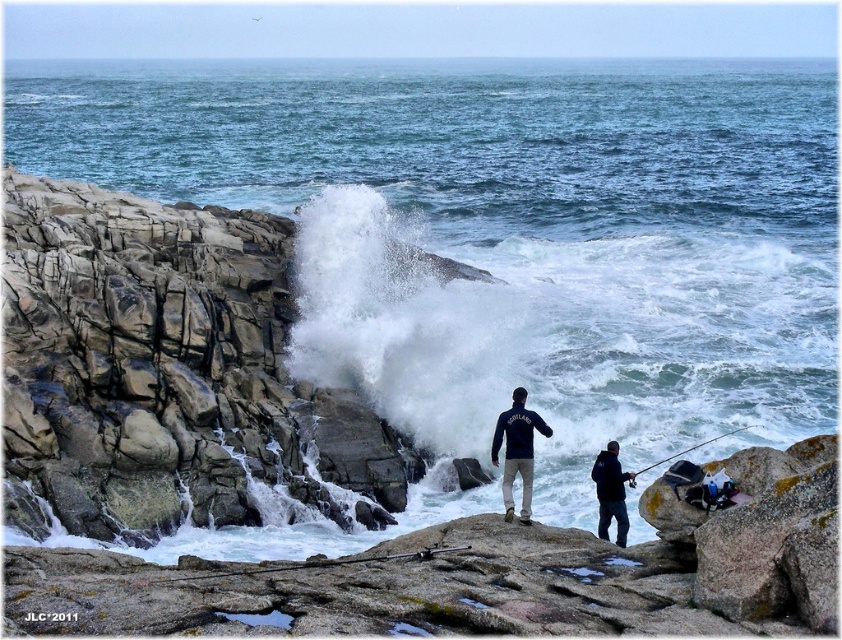
Question: Which point appears farthest from the camera in this image?

Choices:
 (A) (505, 426)
 (B) (430, 556)
 (C) (601, 458)
 (D) (718, 435)

Answer: (D)

Question: Which of the following is the farthest from the observer?

Choices:
 (A) dark blue fleece jacket at center
 (B) black matte fishing pole at lower right
 (C) dark blue jacket at lower right

Answer: (B)

Question: Which point is farther to the camera?

Choices:
 (A) dark blue fleece jacket at center
 (B) metallic silver fishing pole at center
 (C) dark blue jacket at lower right

Answer: (C)

Question: Can you confirm if metallic silver fishing pole at center is positioned below black matte fishing pole at lower right?

Choices:
 (A) yes
 (B) no

Answer: (A)

Question: Does dark blue jacket at lower right appear on the left side of metallic silver fishing pole at center?

Choices:
 (A) yes
 (B) no

Answer: (B)

Question: Does dark blue fleece jacket at center appear on the right side of black matte fishing pole at lower right?

Choices:
 (A) no
 (B) yes

Answer: (A)